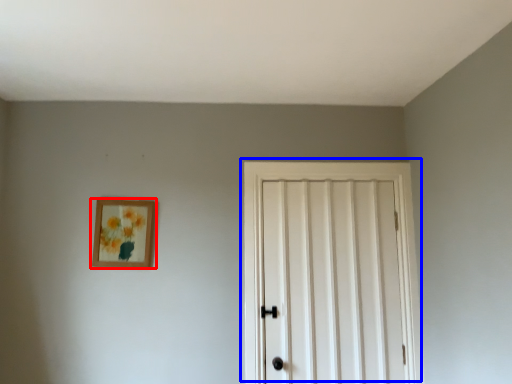
Question: Which point is further to the camera, picture frame (highlighted by a red box) or door (highlighted by a blue box)?

Choices:
 (A) picture frame
 (B) door

Answer: (A)